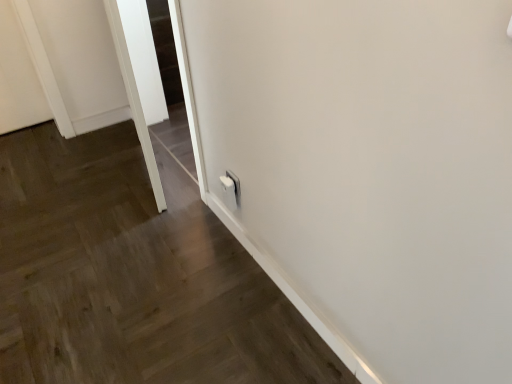
Question: Should I look upward or downward to see transparent glass door at lower left?

Choices:
 (A) down
 (B) up

Answer: (B)